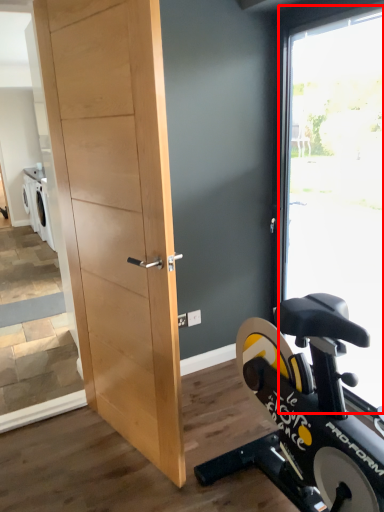
Question: Where is window (annotated by the red box) located in relation to barn door in the image?

Choices:
 (A) left
 (B) right

Answer: (B)